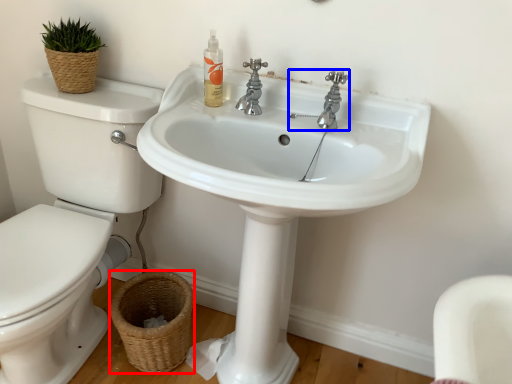
Question: Which object is closer to the camera taking this photo, basket (highlighted by a red box) or tap (highlighted by a blue box)?

Choices:
 (A) basket
 (B) tap

Answer: (B)